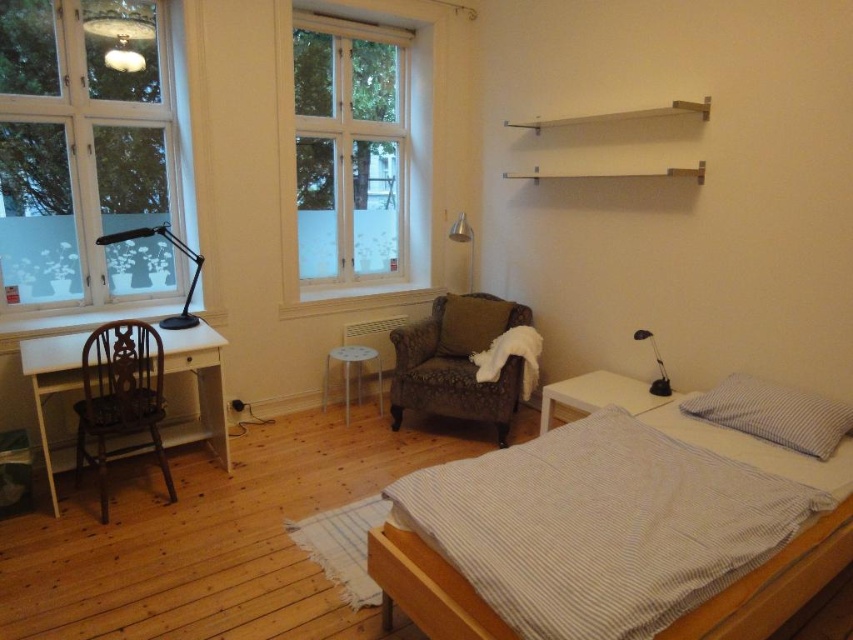
Question: Which object is positioned farthest from the matte glass lampshade at upper left?

Choices:
 (A) metallic silver lampshade at upper center
 (B) white plastic stool at center
 (C) brown wooden chair at left

Answer: (A)

Question: Which object is positioned farthest from the metallic silver lampshade at upper center?

Choices:
 (A) brown wooden chair at left
 (B) matte black desk lamp at left
 (C) velvet-patterned armchair at center
 (D) black plastic lamp at right

Answer: (A)

Question: Which point appears closest to the camera in this image?

Choices:
 (A) (457, 340)
 (B) (721, 426)
 (C) (97, 243)

Answer: (B)

Question: Can you confirm if white checkered pillow at upper right is smaller than matte black desk lamp at left?

Choices:
 (A) no
 (B) yes

Answer: (B)

Question: Does clear glass window at upper left have a lesser width compared to white plastic stool at center?

Choices:
 (A) no
 (B) yes

Answer: (A)

Question: Is white matte window at upper center bigger than soft brown cushion at center?

Choices:
 (A) yes
 (B) no

Answer: (A)